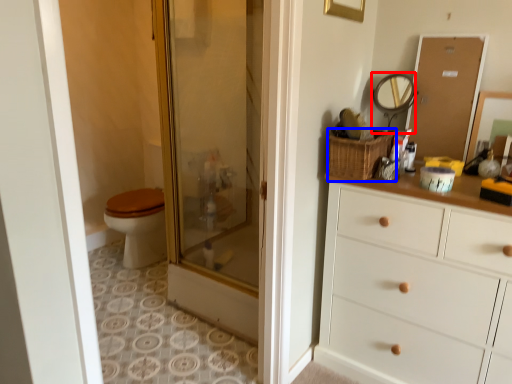
Question: Among these objects, which one is farthest to the camera, mirror (highlighted by a red box) or basket (highlighted by a blue box)?

Choices:
 (A) mirror
 (B) basket

Answer: (A)